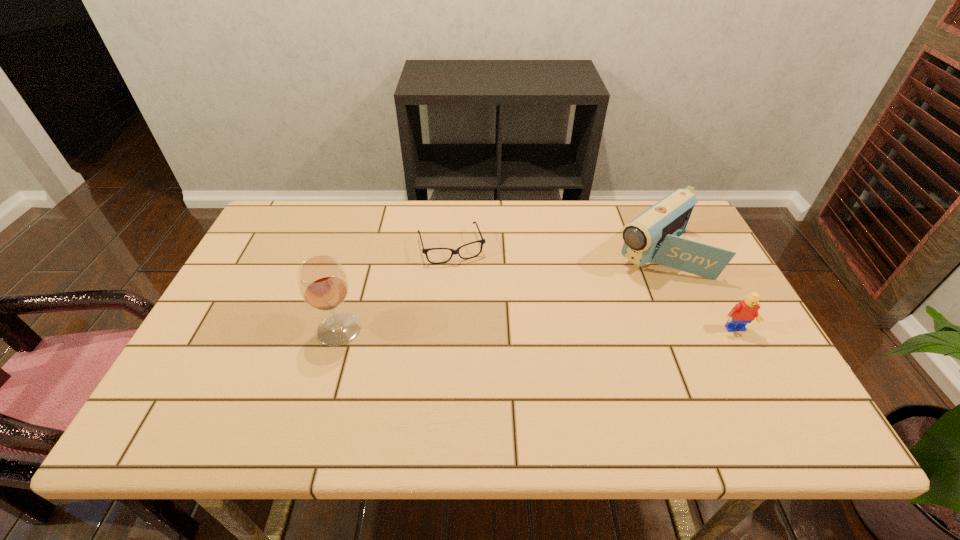
Locate an element on the screen. vacant spot on the desktop that is between the tallest object and the Lego and is positioned on the front-facing side of the second object from left to right is located at coordinates (479, 330).

Locate an element on the screen. This screenshot has width=960, height=540. free space on the desktop that is between the leftmost object and the Lego and is positioned on the side of the second tallest object with the flip-out screen is located at coordinates (557, 330).